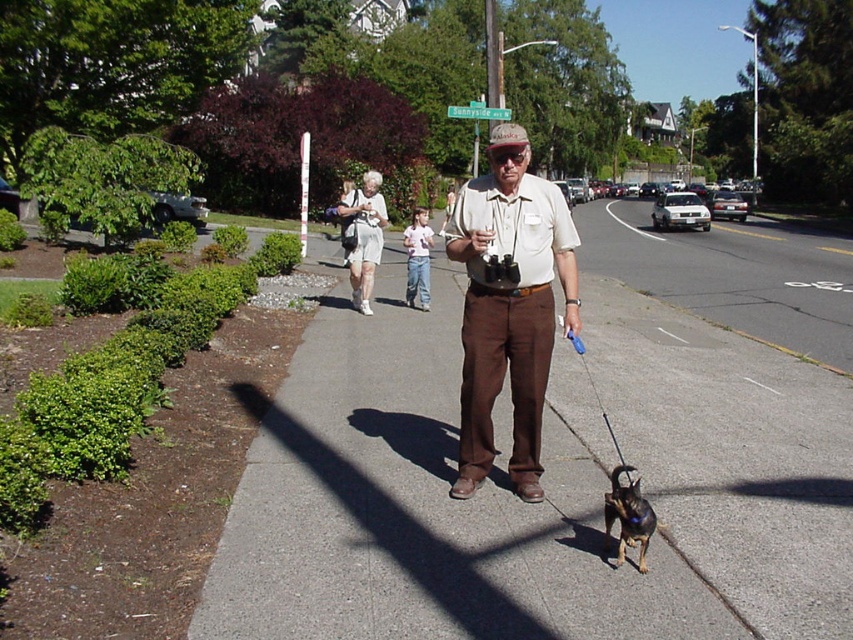
You are a delivery robot on the gray asphalt sidewalk at center. You need to deliver a package to the shiny brown dog at lower center. Can you move directly towards the dog without leaving the sidewalk?

The gray asphalt sidewalk at center is in front of shiny brown dog at lower center, so yes, the delivery robot can move directly towards the dog without leaving the sidewalk since the sidewalk is positioned in front of the dog.

You are a delivery drone flying above the suburban street. You need to land on the gray asphalt sidewalk at center. What are the coordinates where you should land?

The gray asphalt sidewalk at center is located at coordinates point [556,461]. So you should land there.

You are a delivery person trying to place a large package on the gray asphalt sidewalk at center while avoiding the matte khaki shirt at center. Can you fit the package on the sidewalk without overlapping the shirt?

The gray asphalt sidewalk at center has a larger size compared to matte khaki shirt at center, so yes, the package can be placed on the gray asphalt sidewalk at center without overlapping the matte khaki shirt at center as there is enough space.